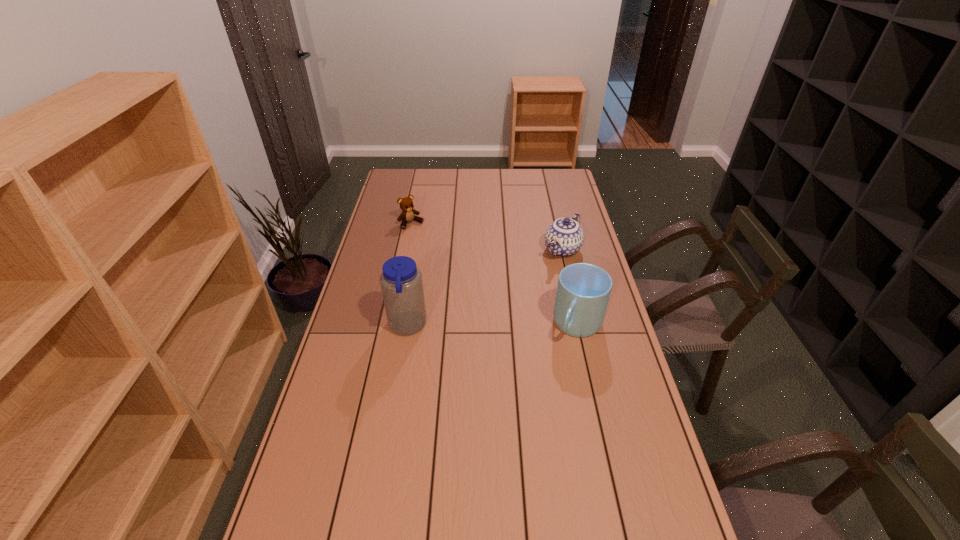
Image resolution: width=960 pixels, height=540 pixels. I want to click on vacant space located 0.160m from the spout of the second farthest object, so click(x=532, y=285).

Where is `vacant space located 0.310m from the spout of the second farthest object`? This screenshot has height=540, width=960. vacant space located 0.310m from the spout of the second farthest object is located at coordinates (510, 307).

I want to click on free spot located 0.210m from the spout of the second farthest object, so click(x=525, y=292).

Identify the location of vacant space located on the front-facing side of the teddy bear. The height and width of the screenshot is (540, 960). (426, 238).

Where is `vacant space located on the front-facing side of the teddy bear`? vacant space located on the front-facing side of the teddy bear is located at coordinates (433, 245).

I want to click on blank space located on the front-facing side of the teddy bear, so click(x=433, y=245).

At what (x,y) coordinates should I click in order to perform the action: click on water bottle located in the left edge section of the desktop. Please return your answer as a coordinate pair (x, y). This screenshot has height=540, width=960. Looking at the image, I should click on (401, 282).

At what (x,y) coordinates should I click in order to perform the action: click on teddy bear located in the left edge section of the desktop. Please return your answer as a coordinate pair (x, y). The image size is (960, 540). Looking at the image, I should click on [x=408, y=214].

Where is `mug at the right edge`? mug at the right edge is located at coordinates (583, 291).

Identify the location of chinaware that is at the right edge. The width and height of the screenshot is (960, 540). (564, 237).